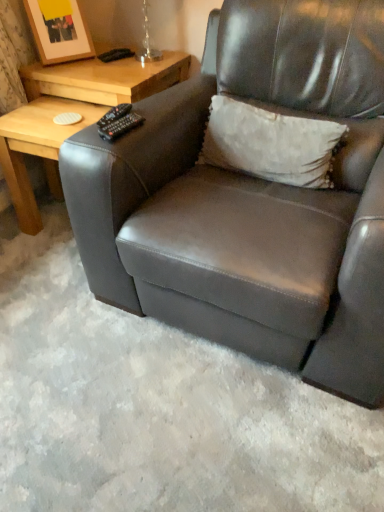
Describe the element at coordinates (38, 149) in the screenshot. The width and height of the screenshot is (384, 512). I see `light wood table at left, placed as the 2th table when sorted from top to bottom` at that location.

Identify the location of white textured pillow at upper center. The width and height of the screenshot is (384, 512). (271, 143).

Image resolution: width=384 pixels, height=512 pixels. What do you see at coordinates (59, 30) in the screenshot? I see `wooden picture frame at upper left` at bounding box center [59, 30].

Identify the location of black plastic remote at upper left. This screenshot has height=512, width=384. (114, 114).

What do you see at coordinates (251, 201) in the screenshot? I see `matte black armchair at center` at bounding box center [251, 201].

Locate an element on the screen. The height and width of the screenshot is (512, 384). matte black armchair at center is located at coordinates (251, 201).

Where is `light wood table at left, which is counted as the 1th table, starting from the bottom`? This screenshot has height=512, width=384. light wood table at left, which is counted as the 1th table, starting from the bottom is located at coordinates (38, 149).

Considering the sizes of objects wooden picture frame at upper left and matte black armchair at center in the image provided, who is wider, wooden picture frame at upper left or matte black armchair at center?

matte black armchair at center is wider.

Based on the photo, from a real-world perspective, is wooden picture frame at upper left on top of matte black armchair at center?

Yes, from a real-world perspective, wooden picture frame at upper left is on top of matte black armchair at center.

Could you tell me if wooden picture frame at upper left is turned towards matte black armchair at center?

Yes, wooden picture frame at upper left is facing matte black armchair at center.

How many degrees apart are the facing directions of wooden picture frame at upper left and matte black armchair at center?

The angle between the facing direction of wooden picture frame at upper left and the facing direction of matte black armchair at center is 62.9 degrees.

Who is bigger, white textured pillow at upper center or matte black armchair at center?

matte black armchair at center.

I want to click on throw pillow above the matte black armchair at center (from a real-world perspective), so click(271, 143).

From the image's perspective, between white textured pillow at upper center and matte black armchair at center, who is located below?

matte black armchair at center, from the image's perspective.

Is white textured pillow at upper center in contact with matte black armchair at center?

No, white textured pillow at upper center is not next to matte black armchair at center.

From a real-world perspective, which is physically above, light brown wood table at upper left, the 2th table in the bottom-to-top sequence, or matte black armchair at center?

In real-world perspective, matte black armchair at center is above.

Which is more to the right, light brown wood table at upper left, the first table in the top-to-bottom sequence, or matte black armchair at center?

Positioned to the right is matte black armchair at center.

Is light brown wood table at upper left, the 2th table in the bottom-to-top sequence, behind matte black armchair at center?

Yes, light brown wood table at upper left, the 2th table in the bottom-to-top sequence, is behind matte black armchair at center.

Is point (186, 60) closer or farther from the camera than point (175, 185)?

Point (186, 60).

Is white textured pillow at upper center located outside light brown wood table at upper left, the 2th table in the bottom-to-top sequence?

That's correct, white textured pillow at upper center is outside of light brown wood table at upper left, the 2th table in the bottom-to-top sequence.

The height and width of the screenshot is (512, 384). I want to click on throw pillow in front of the light brown wood table at upper left, the 2th table in the bottom-to-top sequence, so click(x=271, y=143).

Is white textured pillow at upper center not close to light brown wood table at upper left, the 2th table in the bottom-to-top sequence?

Actually, white textured pillow at upper center and light brown wood table at upper left, the 2th table in the bottom-to-top sequence, are a little close together.

Based on their sizes in the image, would you say white textured pillow at upper center is bigger or smaller than light brown wood table at upper left, the first table in the top-to-bottom sequence?

In the image, white textured pillow at upper center appears to be smaller than light brown wood table at upper left, the first table in the top-to-bottom sequence.

Which is in front, matte black armchair at center or black plastic remote at upper left?

matte black armchair at center.

Which object is wider, matte black armchair at center or black plastic remote at upper left?

Wider between the two is matte black armchair at center.

How much distance is there between matte black armchair at center and black plastic remote at upper left?

matte black armchair at center is 51.10 centimeters away from black plastic remote at upper left.

From the image's perspective, who appears lower, matte black armchair at center or black plastic remote at upper left?

matte black armchair at center, from the image's perspective.

Which object is positioned more to the left, light wood table at left, placed as the 2th table when sorted from top to bottom, or black plastic remote at upper left?

Positioned to the left is light wood table at left, placed as the 2th table when sorted from top to bottom.

Is the surface of light wood table at left, placed as the 2th table when sorted from top to bottom, in direct contact with black plastic remote at upper left?

No, light wood table at left, placed as the 2th table when sorted from top to bottom, is not next to black plastic remote at upper left.

From the image's perspective, does light wood table at left, placed as the 2th table when sorted from top to bottom, appear higher than black plastic remote at upper left?

No, from the image's perspective, light wood table at left, placed as the 2th table when sorted from top to bottom, is not on top of black plastic remote at upper left.

Considering the sizes of objects matte black armchair at center and white textured pillow at upper center in the image provided, who is shorter, matte black armchair at center or white textured pillow at upper center?

Standing shorter between the two is white textured pillow at upper center.

Is matte black armchair at center positioned behind white textured pillow at upper center?

No, matte black armchair at center is closer to the camera.

Which of these two, matte black armchair at center or white textured pillow at upper center, is wider?

With larger width is matte black armchair at center.

Which of these two, matte black armchair at center or white textured pillow at upper center, is bigger?

matte black armchair at center is bigger.

I want to click on chair on the right of the wooden picture frame at upper left, so click(x=251, y=201).

In the image, there is a matte black armchair at center. Where is `throw pillow above it (from the image's perspective)`? throw pillow above it (from the image's perspective) is located at coordinates (271, 143).

Looking at this image, from the image, which object appears to be nearer to wooden picture frame at upper left, light wood table at left, placed as the 2th table when sorted from top to bottom, or white textured pillow at upper center?

light wood table at left, placed as the 2th table when sorted from top to bottom, lies closer to wooden picture frame at upper left than the other object.

Looking at the image, which one is located further to white textured pillow at upper center, light brown wood table at upper left, the first table in the top-to-bottom sequence, or matte black armchair at center?

light brown wood table at upper left, the first table in the top-to-bottom sequence, is positioned further to the anchor white textured pillow at upper center.

Looking at this image, from the image, which object appears to be farther from light brown wood table at upper left, the 2th table in the bottom-to-top sequence, light wood table at left, which is counted as the 1th table, starting from the bottom, or black plastic remote at upper left?

Based on the image, black plastic remote at upper left appears to be further to light brown wood table at upper left, the 2th table in the bottom-to-top sequence.

Looking at the image, which one is located closer to light wood table at left, which is counted as the 1th table, starting from the bottom, black plastic remote at upper left or light brown wood table at upper left, the first table in the top-to-bottom sequence?

light brown wood table at upper left, the first table in the top-to-bottom sequence.

From the image, which object appears to be nearer to matte black armchair at center, light brown wood table at upper left, the first table in the top-to-bottom sequence, or white textured pillow at upper center?

white textured pillow at upper center is positioned closer to the anchor matte black armchair at center.

Based on their spatial positions, is light wood table at left, placed as the 2th table when sorted from top to bottom, or light brown wood table at upper left, the first table in the top-to-bottom sequence, closer to matte black armchair at center?

The object closer to matte black armchair at center is light brown wood table at upper left, the first table in the top-to-bottom sequence.

From the image, which object appears to be nearer to matte black armchair at center, black plastic remote at upper left or white textured pillow at upper center?

white textured pillow at upper center is positioned closer to the anchor matte black armchair at center.

Looking at the image, which one is located closer to matte black armchair at center, wooden picture frame at upper left or light brown wood table at upper left, the first table in the top-to-bottom sequence?

light brown wood table at upper left, the first table in the top-to-bottom sequence, lies closer to matte black armchair at center than the other object.

Where is `remote between matte black armchair at center and light wood table at left, placed as the 2th table when sorted from top to bottom, in the front-back direction`? This screenshot has height=512, width=384. remote between matte black armchair at center and light wood table at left, placed as the 2th table when sorted from top to bottom, in the front-back direction is located at coordinates (114, 114).

The image size is (384, 512). Identify the location of remote between light brown wood table at upper left, the first table in the top-to-bottom sequence, and white textured pillow at upper center from left to right. (114, 114).

You are a GUI agent. You are given a task and a screenshot of the screen. Output one action in this format:
    pyautogui.click(x=<x>, y=<y>)
    Task: Click on the remote that lies between wooden picture frame at upper left and light wood table at left, which is counted as the 1th table, starting from the bottom, from top to bottom
    Image resolution: width=384 pixels, height=512 pixels.
    Given the screenshot: What is the action you would take?
    pyautogui.click(x=114, y=114)

The image size is (384, 512). Identify the location of table between light wood table at left, placed as the 2th table when sorted from top to bottom, and white textured pillow at upper center, in the horizontal direction. (71, 111).